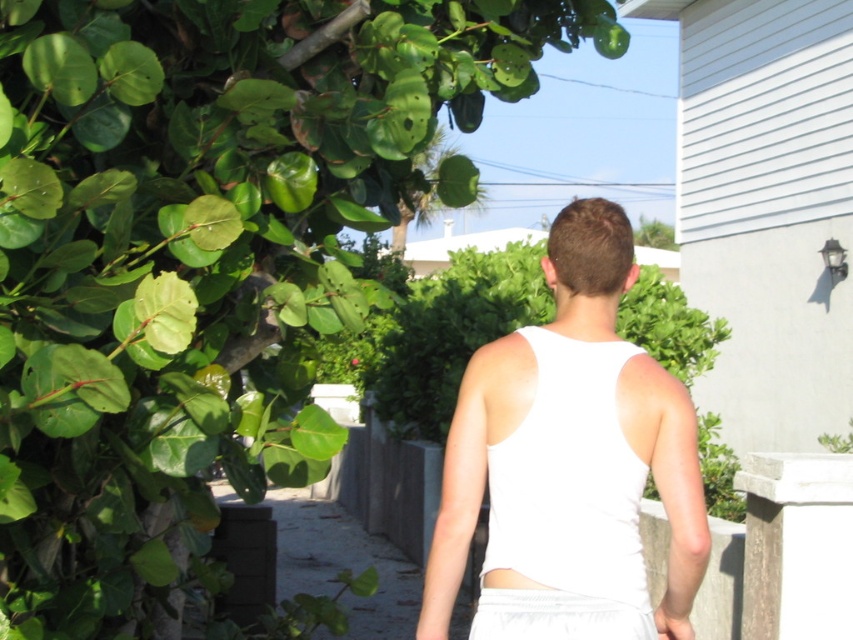
Question: Which of the following is the farthest from the observer?

Choices:
 (A) white fabric tank top at center
 (B) white fabric shorts at center
 (C) green leafy tree at upper left

Answer: (A)

Question: Can you confirm if white fabric tank top at center is positioned below white matte vest at center?

Choices:
 (A) no
 (B) yes

Answer: (A)

Question: Which of the following is the farthest from the observer?

Choices:
 (A) white fabric tank top at center
 (B) white fabric shorts at center
 (C) green leafy tree at upper left
 (D) white matte vest at center

Answer: (D)

Question: Observing the image, what is the correct spatial positioning of green leafy tree at upper left in reference to white fabric tank top at center?

Choices:
 (A) left
 (B) right

Answer: (A)

Question: Considering the relative positions of white fabric tank top at center and white fabric shorts at center in the image provided, where is white fabric tank top at center located with respect to white fabric shorts at center?

Choices:
 (A) below
 (B) above

Answer: (B)

Question: Which of these objects is positioned closest to the white fabric tank top at center?

Choices:
 (A) white fabric shorts at center
 (B) green leafy tree at upper left
 (C) white matte vest at center

Answer: (C)